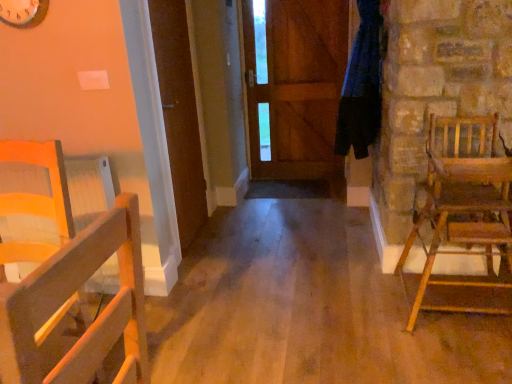
The width and height of the screenshot is (512, 384). I want to click on vacant space in front of wooden door at center, the first door in the left-to-right sequence, so click(217, 260).